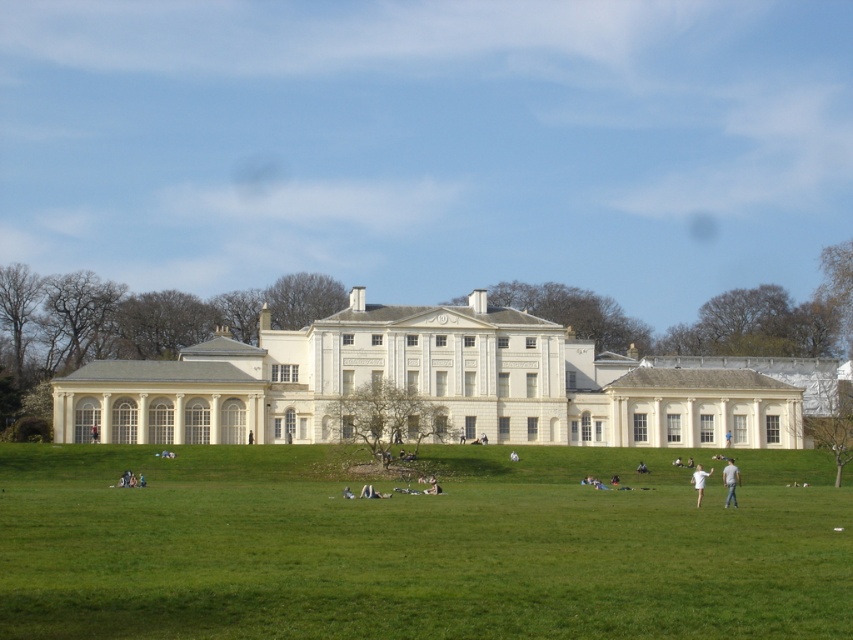
Can you confirm if green grass at center is bigger than white smooth mansion at center?

Incorrect, green grass at center is not larger than white smooth mansion at center.

Is green grass at center thinner than white smooth mansion at center?

Yes.

Is point (241, 452) positioned behind point (799, 445)?

No, (241, 452) is closer to viewer.

At what (x,y) coordinates should I click in order to perform the action: click on green grass at center. Please return your answer as a coordinate pair (x, y). Looking at the image, I should click on (416, 547).

Which of these two, light brown leather jacket at lower right or white cotton shirt at lower center, stands taller?

Standing taller between the two is white cotton shirt at lower center.

Can you confirm if light brown leather jacket at lower right is positioned to the left of white cotton shirt at lower center?

No, light brown leather jacket at lower right is not to the left of white cotton shirt at lower center.

The height and width of the screenshot is (640, 853). What do you see at coordinates (730, 481) in the screenshot?
I see `light brown leather jacket at lower right` at bounding box center [730, 481].

The image size is (853, 640). I want to click on light brown leather jacket at lower right, so tap(730, 481).

Can you confirm if white smooth mansion at center is positioned to the right of light brown leather jacket at lower right?

In fact, white smooth mansion at center is to the left of light brown leather jacket at lower right.

Is point (500, 403) behind point (732, 467)?

Yes, it is behind point (732, 467).

Find the location of a particular element. white smooth mansion at center is located at coordinates (442, 385).